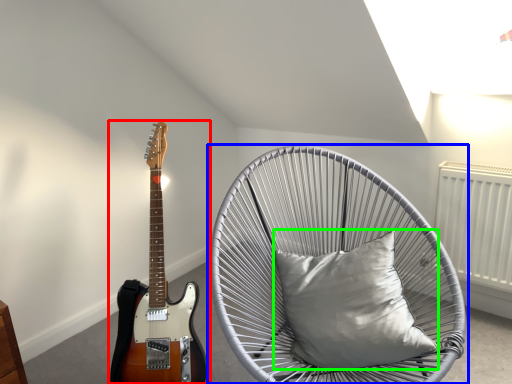
Question: Which object is positioned farthest from guitar (highlighted by a red box)? Select from chair (highlighted by a blue box) and pillow (highlighted by a green box).

Choices:
 (A) chair
 (B) pillow

Answer: (B)